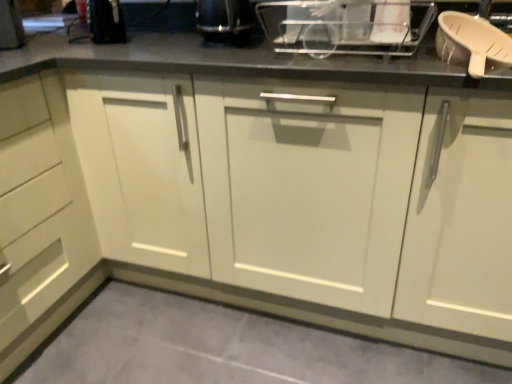
The width and height of the screenshot is (512, 384). I want to click on white plastic dish rack at upper center, the second appliance viewed from the left, so click(391, 22).

Considering the sizes of objects white plastic dish rack at upper center, which appears as the first appliance when viewed from the right, and gray tile floor at lower center in the image provided, who is thinner, white plastic dish rack at upper center, which appears as the first appliance when viewed from the right, or gray tile floor at lower center?

With smaller width is white plastic dish rack at upper center, which appears as the first appliance when viewed from the right.

Where is `concrete that is on the left side of white plastic dish rack at upper center, which appears as the first appliance when viewed from the right`? Image resolution: width=512 pixels, height=384 pixels. concrete that is on the left side of white plastic dish rack at upper center, which appears as the first appliance when viewed from the right is located at coordinates (222, 348).

Which of these two, white plastic dish rack at upper center, the second appliance viewed from the left, or gray tile floor at lower center, is bigger?

Bigger between the two is gray tile floor at lower center.

Is white plastic dish rack at upper center, the second appliance viewed from the left, outside of gray tile floor at lower center?

Indeed, white plastic dish rack at upper center, the second appliance viewed from the left, is completely outside gray tile floor at lower center.

Which object is thinner, gray tile floor at lower center or black plastic kettle at upper center, which appears as the 2th appliance when viewed from the right?

black plastic kettle at upper center, which appears as the 2th appliance when viewed from the right, is thinner.

Considering the points (116, 301) and (212, 25), which point is in front, point (116, 301) or point (212, 25)?

The point (212, 25) is closer.

How different are the orientations of gray tile floor at lower center and black plastic kettle at upper center, acting as the 1th appliance starting from the left, in degrees?

89.7 degrees.

From the picture: Is black plastic kettle at upper center, acting as the 1th appliance starting from the left, at the back of gray tile floor at lower center?

No, gray tile floor at lower center's orientation is not away from black plastic kettle at upper center, acting as the 1th appliance starting from the left.

Which of these two, black plastic kettle at upper center, acting as the 1th appliance starting from the left, or white plastic dish rack at upper center, which appears as the first appliance when viewed from the right, is smaller?

With smaller size is white plastic dish rack at upper center, which appears as the first appliance when viewed from the right.

From a real-world perspective, is black plastic kettle at upper center, acting as the 1th appliance starting from the left, physically above white plastic dish rack at upper center, the second appliance viewed from the left?

No, from a real-world perspective, black plastic kettle at upper center, acting as the 1th appliance starting from the left, is not over white plastic dish rack at upper center, the second appliance viewed from the left

Does black plastic kettle at upper center, which appears as the 2th appliance when viewed from the right, have a lesser height compared to white plastic dish rack at upper center, the second appliance viewed from the left?

Correct, black plastic kettle at upper center, which appears as the 2th appliance when viewed from the right, is not as tall as white plastic dish rack at upper center, the second appliance viewed from the left.

Which of these two, black plastic kettle at upper center, which appears as the 2th appliance when viewed from the right, or gray tile floor at lower center, is wider?

gray tile floor at lower center is wider.

Is black plastic kettle at upper center, which appears as the 2th appliance when viewed from the right, not close to gray tile floor at lower center?

Absolutely, black plastic kettle at upper center, which appears as the 2th appliance when viewed from the right, is distant from gray tile floor at lower center.

Considering their positions, is black plastic kettle at upper center, acting as the 1th appliance starting from the left, located in front of or behind gray tile floor at lower center?

In the image, black plastic kettle at upper center, acting as the 1th appliance starting from the left, appears behind gray tile floor at lower center.

From a real-world perspective, which object stands above the other?

black plastic kettle at upper center, which appears as the 2th appliance when viewed from the right.

From the image's perspective, starting from the gray tile floor at lower center, which appliance is the 1st one above? Please provide its 2D coordinates.

[(391, 22)]

In the image, is gray tile floor at lower center on the left side or the right side of white plastic dish rack at upper center, which appears as the first appliance when viewed from the right?

Clearly, gray tile floor at lower center is on the left of white plastic dish rack at upper center, which appears as the first appliance when viewed from the right, in the image.

From the image's perspective, is gray tile floor at lower center above white plastic dish rack at upper center, the second appliance viewed from the left?

No, from the image's perspective, gray tile floor at lower center is not above white plastic dish rack at upper center, the second appliance viewed from the left.

Which is in front, point (227, 360) or point (390, 42)?

The point (390, 42) is in front.

From a real-world perspective, who is located lower, white plastic dish rack at upper center, which appears as the first appliance when viewed from the right, or black plastic kettle at upper center, which appears as the 2th appliance when viewed from the right?

black plastic kettle at upper center, which appears as the 2th appliance when viewed from the right, is physically lower.

Which object is positioned more to the right, white plastic dish rack at upper center, the second appliance viewed from the left, or black plastic kettle at upper center, acting as the 1th appliance starting from the left?

white plastic dish rack at upper center, the second appliance viewed from the left.

Based on the photo, could you tell me if white plastic dish rack at upper center, the second appliance viewed from the left, is turned towards black plastic kettle at upper center, acting as the 1th appliance starting from the left?

No, white plastic dish rack at upper center, the second appliance viewed from the left, does not turn towards black plastic kettle at upper center, acting as the 1th appliance starting from the left.

Is point (387, 40) positioned in front of point (237, 44)?

That is True.

This screenshot has height=384, width=512. Identify the location of appliance that is the 1st one when counting backward from the gray tile floor at lower center. (391, 22).

I want to click on appliance that is on the left side of gray tile floor at lower center, so click(x=225, y=20).

Estimate the real-world distances between objects in this image. Which object is further from gray tile floor at lower center, black plastic kettle at upper center, which appears as the 2th appliance when viewed from the right, or white plastic dish rack at upper center, the second appliance viewed from the left?

Among the two, white plastic dish rack at upper center, the second appliance viewed from the left, is located further to gray tile floor at lower center.

Considering their positions, is gray tile floor at lower center positioned further to white plastic dish rack at upper center, which appears as the first appliance when viewed from the right, than black plastic kettle at upper center, which appears as the 2th appliance when viewed from the right?

The object further to white plastic dish rack at upper center, which appears as the first appliance when viewed from the right, is gray tile floor at lower center.

Considering their positions, is gray tile floor at lower center positioned closer to black plastic kettle at upper center, acting as the 1th appliance starting from the left, than white plastic dish rack at upper center, which appears as the first appliance when viewed from the right?

Among the two, white plastic dish rack at upper center, which appears as the first appliance when viewed from the right, is located nearer to black plastic kettle at upper center, acting as the 1th appliance starting from the left.

Which object lies further to the anchor point black plastic kettle at upper center, which appears as the 2th appliance when viewed from the right, white plastic dish rack at upper center, which appears as the first appliance when viewed from the right, or gray tile floor at lower center?

The object further to black plastic kettle at upper center, which appears as the 2th appliance when viewed from the right, is gray tile floor at lower center.

Looking at the image, which one is located closer to gray tile floor at lower center, white plastic dish rack at upper center, the second appliance viewed from the left, or black plastic kettle at upper center, which appears as the 2th appliance when viewed from the right?

The object closer to gray tile floor at lower center is black plastic kettle at upper center, which appears as the 2th appliance when viewed from the right.

Considering their positions, is black plastic kettle at upper center, acting as the 1th appliance starting from the left, positioned further to white plastic dish rack at upper center, the second appliance viewed from the left, than gray tile floor at lower center?

The object further to white plastic dish rack at upper center, the second appliance viewed from the left, is gray tile floor at lower center.

The image size is (512, 384). Find the location of `appliance between black plastic kettle at upper center, which appears as the 2th appliance when viewed from the right, and gray tile floor at lower center, in the vertical direction`. appliance between black plastic kettle at upper center, which appears as the 2th appliance when viewed from the right, and gray tile floor at lower center, in the vertical direction is located at coordinates (391, 22).